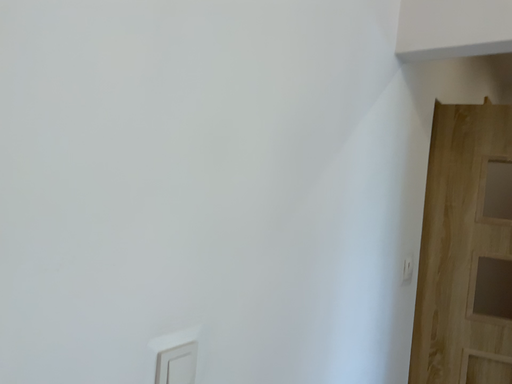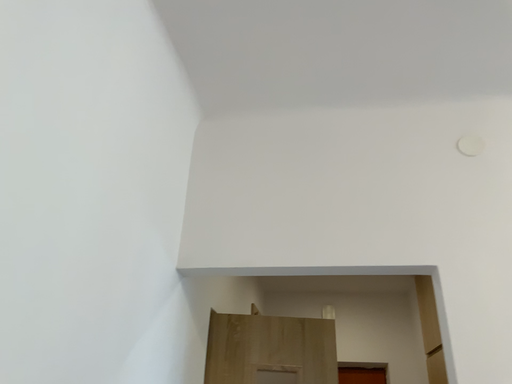
Question: How did the camera likely rotate when shooting the video?

Choices:
 (A) rotated right
 (B) rotated left

Answer: (A)